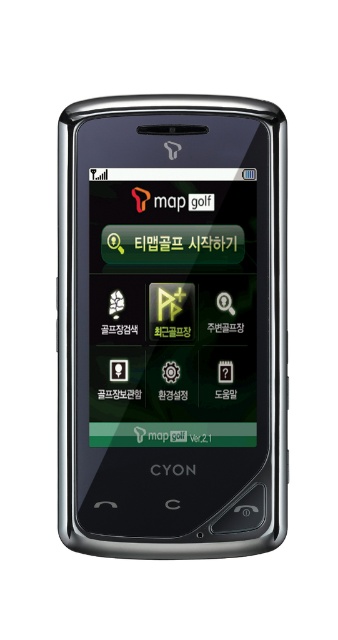
Question: Can you confirm if satin black smartphone at center is positioned above matte black screen at center?

Choices:
 (A) no
 (B) yes

Answer: (A)

Question: Is satin black smartphone at center to the right of matte black screen at center from the viewer's perspective?

Choices:
 (A) no
 (B) yes

Answer: (A)

Question: Observing the image, what is the correct spatial positioning of satin black smartphone at center in reference to matte black screen at center?

Choices:
 (A) right
 (B) left

Answer: (B)

Question: Which point is farther to the camera?

Choices:
 (A) (60, 512)
 (B) (146, 429)

Answer: (B)